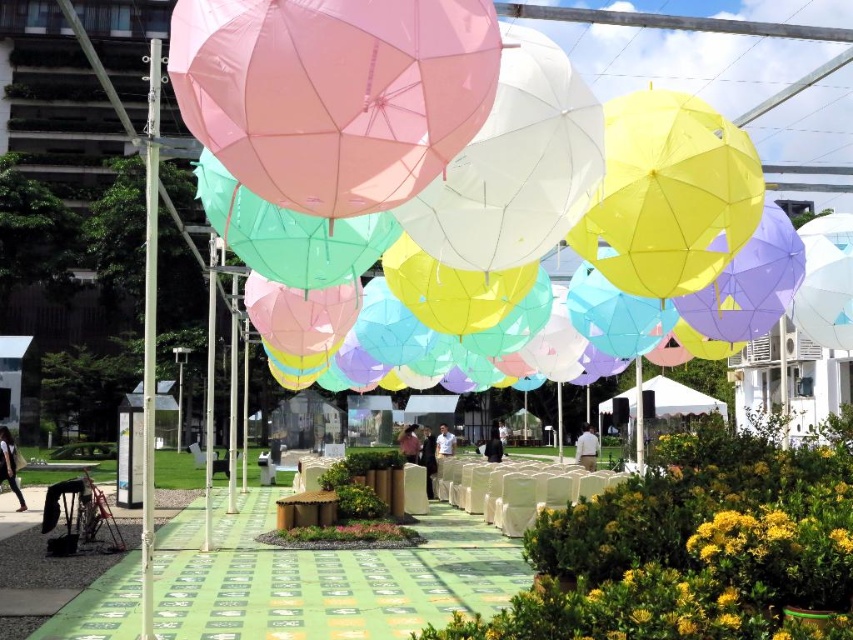
You are standing at the entrance of the event space and see two points marked on the ground. The first point is at coordinate point(209,141) and the second is at point(692,396). If you want to walk towards the second point, which point should you pass first?

Since point(209,141) is in front of point(692,396), you will first pass point(209,141) before reaching point(692,396).

You are at an outdoor event and want to stay under the shade. Which object, the matte pink umbrella at upper center or the white fabric canopy at center, is the better option for shade?

The matte pink umbrella at upper center is positioned over the white fabric canopy at center, so it provides direct shade over the canopy area. Therefore, the matte pink umbrella at upper center would be the better option for shade.